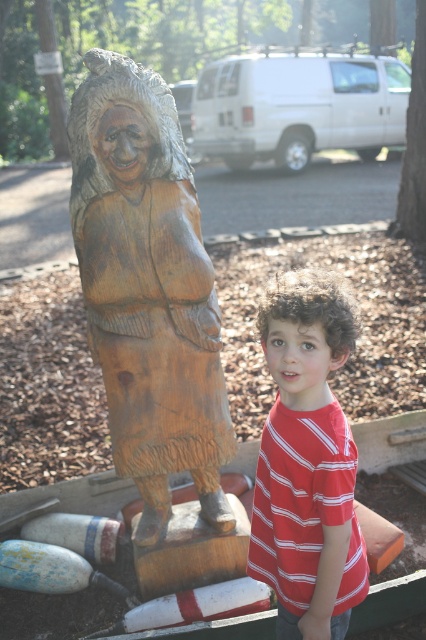
You are a photographer trying to capture both the wooden carving at left and the red striped shirt at center in the same frame. Since you can only focus on one object at a time, which object should you focus on first to ensure the other remains in the background?

You should focus on the wooden carving at left first because it is closer to you than the red striped shirt at center, ensuring the shirt stays in the background.

From the picture: You are a photographer trying to capture a clear photo of the wooden carving at left and the red striped shirt at center. However, you notice that one object is blocking the view of the other. Which object is in front and which is behind?

The wooden carving at left is positioned over red striped shirt at center, meaning it is in front and blocking the view of the red striped shirt at center which is behind.